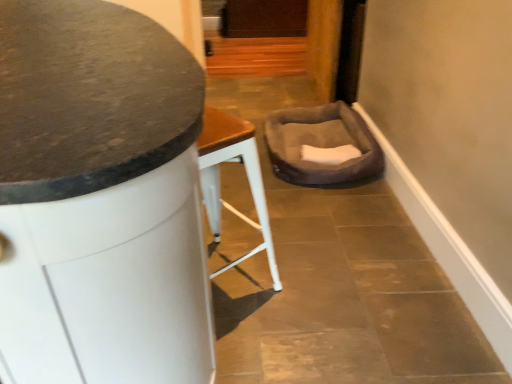
Question: From their relative heights in the image, would you say granite countertop at center is taller or shorter than brown plush pet bed at center?

Choices:
 (A) short
 (B) tall

Answer: (B)

Question: Looking at the image, does granite countertop at center seem bigger or smaller compared to brown plush pet bed at center?

Choices:
 (A) big
 (B) small

Answer: (A)

Question: From a real-world perspective, is granite countertop at center above or below brown plush pet bed at center?

Choices:
 (A) above
 (B) below

Answer: (A)

Question: Considering the positions of brown plush pet bed at center and granite countertop at center in the image, is brown plush pet bed at center taller or shorter than granite countertop at center?

Choices:
 (A) tall
 (B) short

Answer: (B)

Question: Is point (362, 132) closer or farther from the camera than point (90, 372)?

Choices:
 (A) closer
 (B) farther

Answer: (B)

Question: Would you say brown plush pet bed at center is to the left or to the right of granite countertop at center in the picture?

Choices:
 (A) left
 (B) right

Answer: (B)

Question: Considering the positions of brown plush pet bed at center and granite countertop at center in the image, is brown plush pet bed at center wider or thinner than granite countertop at center?

Choices:
 (A) wide
 (B) thin

Answer: (B)